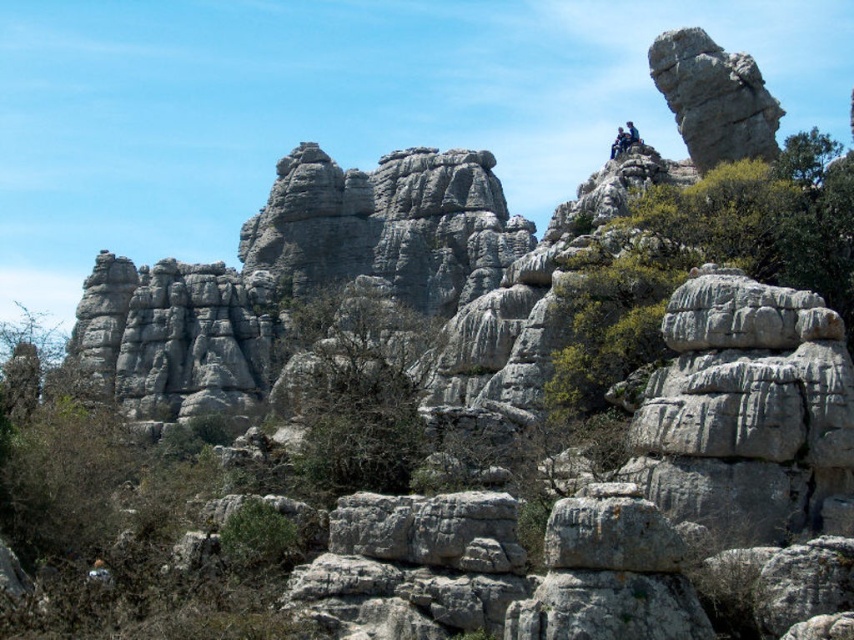
Between green leafy tree at center and gray rock formation at upper right, which one has more height?

green leafy tree at center

Does green leafy tree at center have a larger size compared to gray rock formation at upper right?

Indeed, green leafy tree at center has a larger size compared to gray rock formation at upper right.

Image resolution: width=854 pixels, height=640 pixels. Describe the element at coordinates (355, 388) in the screenshot. I see `green leafy tree at center` at that location.

Identify the location of green leafy tree at center. (355, 388).

Which is above, green leafy shrub at upper right or dark blue jeans at upper center?

dark blue jeans at upper center is higher up.

Locate an element on the screen. The image size is (854, 640). green leafy shrub at upper right is located at coordinates (703, 259).

Which is behind, point (758, 198) or point (322, 435)?

Positioned behind is point (758, 198).

Can you confirm if green leafy shrub at upper right is bigger than green leafy tree at center?

No, green leafy shrub at upper right is not bigger than green leafy tree at center.

What do you see at coordinates (703, 259) in the screenshot? I see `green leafy shrub at upper right` at bounding box center [703, 259].

This screenshot has height=640, width=854. In order to click on green leafy shrub at upper right in this screenshot , I will do `click(703, 259)`.